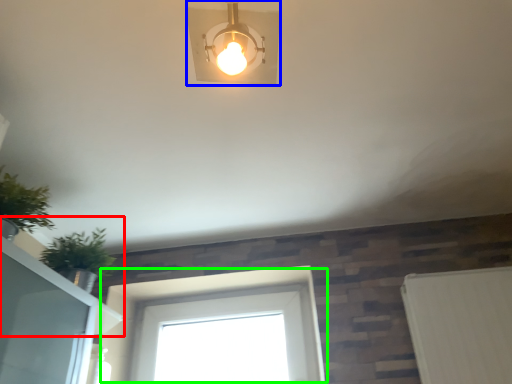
Question: Which is nearer to the window sill (highlighted by a red box)? lamp (highlighted by a blue box) or window (highlighted by a green box).

Choices:
 (A) lamp
 (B) window

Answer: (B)